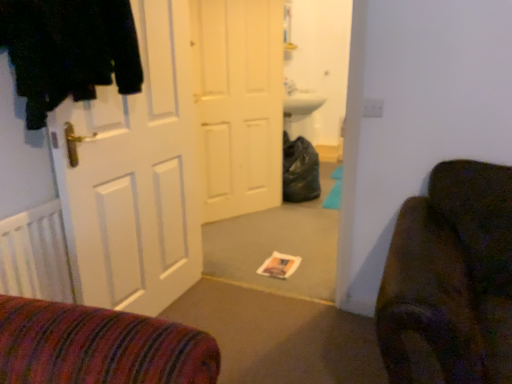
This screenshot has width=512, height=384. Describe the element at coordinates (134, 176) in the screenshot. I see `white matte door at left, which ranks as the 2th door in back-to-front order` at that location.

Image resolution: width=512 pixels, height=384 pixels. Find the location of `white matte door at center, arranged as the first door when viewed from the back`. white matte door at center, arranged as the first door when viewed from the back is located at coordinates (239, 103).

Identify the location of black fuzzy coat at left. The width and height of the screenshot is (512, 384). (69, 50).

Is white matte door at left, which ranks as the 2th door in back-to-front order, directly adjacent to black fuzzy coat at left?

No, white matte door at left, which ranks as the 2th door in back-to-front order, is not in contact with black fuzzy coat at left.

In terms of height, does white matte door at left, which ranks as the 2th door in back-to-front order, look taller or shorter compared to black fuzzy coat at left?

white matte door at left, which ranks as the 2th door in back-to-front order, is taller than black fuzzy coat at left.

This screenshot has height=384, width=512. In order to click on door below the black fuzzy coat at left (from the image's perspective) in this screenshot , I will do `click(134, 176)`.

Is the depth of white matte door at left, which appears as the first door when viewed from the front, greater than that of black fuzzy coat at left?

Yes, the depth of white matte door at left, which appears as the first door when viewed from the front, is greater than that of black fuzzy coat at left.

Can you tell me how much white matte door at center, arranged as the first door when viewed from the back, and black fuzzy coat at left differ in facing direction?

The angular difference between white matte door at center, arranged as the first door when viewed from the back, and black fuzzy coat at left is 40 degrees.

From the image's perspective, does white matte door at center, arranged as the first door when viewed from the back, appear higher than black fuzzy coat at left?

Indeed, from the image's perspective, white matte door at center, arranged as the first door when viewed from the back, is shown above black fuzzy coat at left.

Can you confirm if white matte door at center, arranged as the first door when viewed from the back, is positioned to the left of black fuzzy coat at left?

No.

From a real-world perspective, is white matte door at center, which is the second door in front-to-back order, positioned above or below black fuzzy coat at left?

Clearly, from a real-world perspective, white matte door at center, which is the second door in front-to-back order, is below black fuzzy coat at left.

Is white matte door at left, which appears as the first door when viewed from the front, oriented towards white matte door at center, arranged as the first door when viewed from the back?

No, white matte door at left, which appears as the first door when viewed from the front, is not aimed at white matte door at center, arranged as the first door when viewed from the back.

Considering the relative sizes of white matte door at left, which appears as the first door when viewed from the front, and white matte door at center, which is the second door in front-to-back order, in the image provided, is white matte door at left, which appears as the first door when viewed from the front, wider than white matte door at center, which is the second door in front-to-back order,?

No.

Does point (72, 123) appear closer or farther from the camera than point (211, 129)?

Clearly, point (72, 123) is closer to the camera than point (211, 129).

How many degrees apart are the facing directions of white matte door at center, which is the second door in front-to-back order, and white matte door at left, which ranks as the 2th door in back-to-front order?

There is a 29.9-degree angle between the facing directions of white matte door at center, which is the second door in front-to-back order, and white matte door at left, which ranks as the 2th door in back-to-front order.

Which object is closer to the camera, white matte door at center, which is the second door in front-to-back order, or white matte door at left, which ranks as the 2th door in back-to-front order?

Positioned in front is white matte door at left, which ranks as the 2th door in back-to-front order.

I want to click on door located in front of the white matte door at center, which is the second door in front-to-back order, so click(134, 176).

Does white matte door at center, arranged as the first door when viewed from the back, have a lesser height compared to white matte door at left, which appears as the first door when viewed from the front?

No.

Is black fuzzy coat at left far away from white matte door at left, which ranks as the 2th door in back-to-front order?

No.

From the image's perspective, is black fuzzy coat at left positioned above or below white matte door at left, which appears as the first door when viewed from the front?

From the image's perspective, black fuzzy coat at left appears above white matte door at left, which appears as the first door when viewed from the front.

Locate an element on the screen. clothing lying in front of the white matte door at center, which is the second door in front-to-back order is located at coordinates (69, 50).

Consider the image. From the image's perspective, which object appears higher, black fuzzy coat at left or white matte door at center, arranged as the first door when viewed from the back?

white matte door at center, arranged as the first door when viewed from the back.

Considering the sizes of objects black fuzzy coat at left and white matte door at center, which is the second door in front-to-back order, in the image provided, who is bigger, black fuzzy coat at left or white matte door at center, which is the second door in front-to-back order,?

Bigger between the two is white matte door at center, which is the second door in front-to-back order.

From a real-world perspective, starting from the black fuzzy coat at left, which door is the 2nd one below it? Please provide its 2D coordinates.

[(134, 176)]

The height and width of the screenshot is (384, 512). What are the coordinates of `clothing above the white matte door at center, arranged as the first door when viewed from the back (from a real-world perspective)` in the screenshot? It's located at (69, 50).

Considering their positions, is black fuzzy coat at left positioned further to white matte door at left, which ranks as the 2th door in back-to-front order, than white matte door at center, which is the second door in front-to-back order?

white matte door at center, which is the second door in front-to-back order, lies further to white matte door at left, which ranks as the 2th door in back-to-front order, than the other object.

Which object lies further to the anchor point black fuzzy coat at left, white matte door at center, which is the second door in front-to-back order, or white matte door at left, which appears as the first door when viewed from the front?

white matte door at center, which is the second door in front-to-back order, is positioned further to the anchor black fuzzy coat at left.

Looking at this image, based on their spatial positions, is white matte door at left, which appears as the first door when viewed from the front, or black fuzzy coat at left further from white matte door at center, arranged as the first door when viewed from the back?

black fuzzy coat at left.

From the picture: From the image, which object appears to be nearer to black fuzzy coat at left, white matte door at left, which appears as the first door when viewed from the front, or white matte door at center, which is the second door in front-to-back order?

white matte door at left, which appears as the first door when viewed from the front, is positioned closer to the anchor black fuzzy coat at left.

Which object lies further to the anchor point white matte door at center, which is the second door in front-to-back order, black fuzzy coat at left or white matte door at left, which ranks as the 2th door in back-to-front order?

black fuzzy coat at left.

Looking at the image, which one is located closer to white matte door at left, which appears as the first door when viewed from the front, white matte door at center, arranged as the first door when viewed from the back, or black fuzzy coat at left?

black fuzzy coat at left.

Locate an element on the screen. door between black fuzzy coat at left and white matte door at center, arranged as the first door when viewed from the back, in the front-back direction is located at coordinates (134, 176).